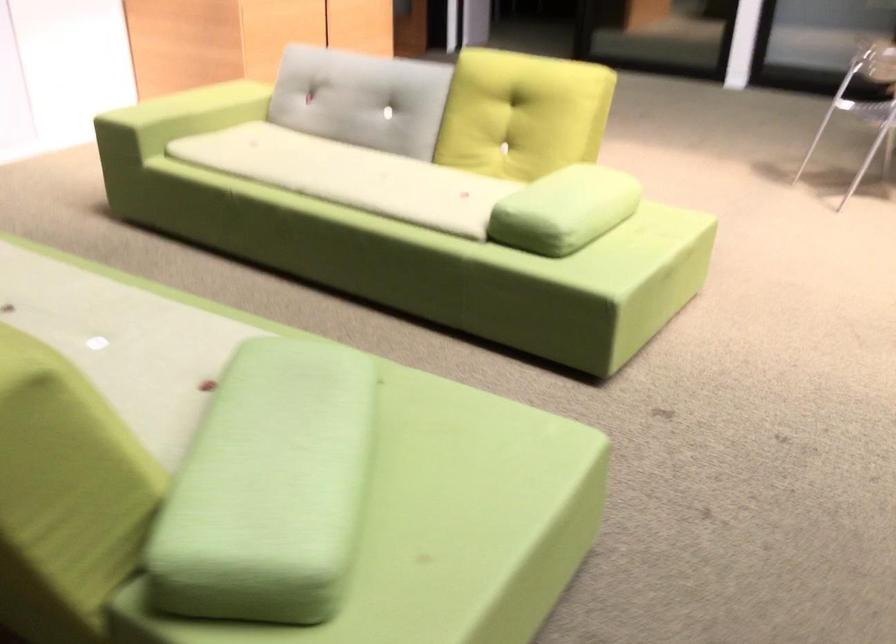
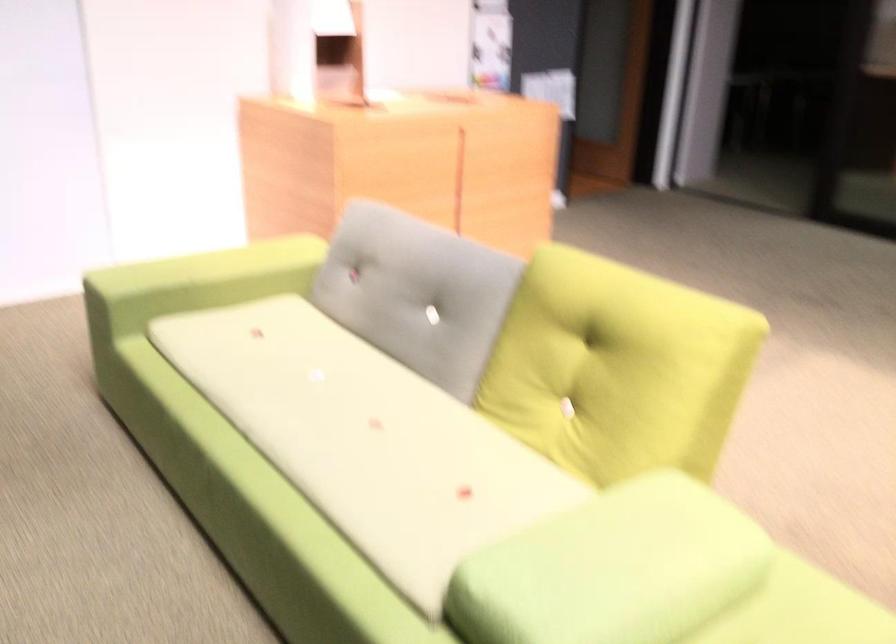
Question: I am providing you with two images of the same scene from different viewpoints. After the viewpoint changes to image2, which objects are now occluded?

Choices:
 (A) yellow back cushion
 (B) grey back cushion
 (C) green sofa armrest
 (D) none of these

Answer: (D)